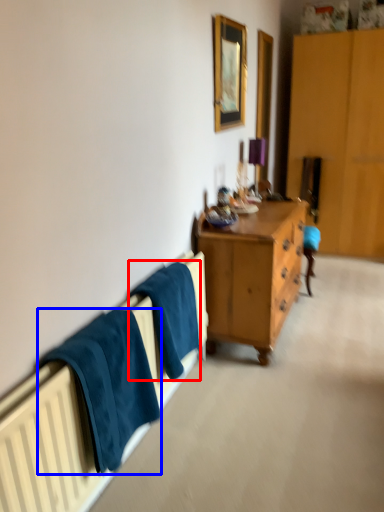
Question: Which object appears closest to the camera in this image, bath towel (highlighted by a red box) or towel/napkin (highlighted by a blue box)?

Choices:
 (A) bath towel
 (B) towel/napkin

Answer: (B)